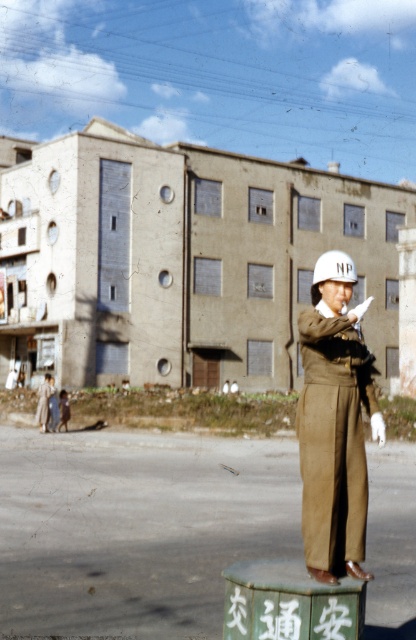
You are a tailor who needs to create a uniform replica of the traffic officer. Given that the matte khaki uniform at center is narrower than the white matte helmet at center, which item would require more fabric in terms of width?

The white matte helmet at center requires more fabric in terms of width since it is wider than the matte khaki uniform at center.

You are a traffic officer standing on a small pedestal with Chinese characters inscribed on it. You notice a point in the scene at coordinates (334, 422). What object is located at that point?

The matte khaki uniform at center is located at point (334, 422).